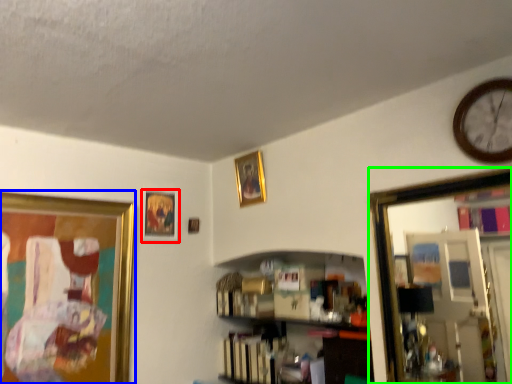
Question: Based on their relative distances, which object is nearer to picture frame (highlighted by a red box)? Choose from picture frame (highlighted by a blue box) and mirror (highlighted by a green box).

Choices:
 (A) picture frame
 (B) mirror

Answer: (A)